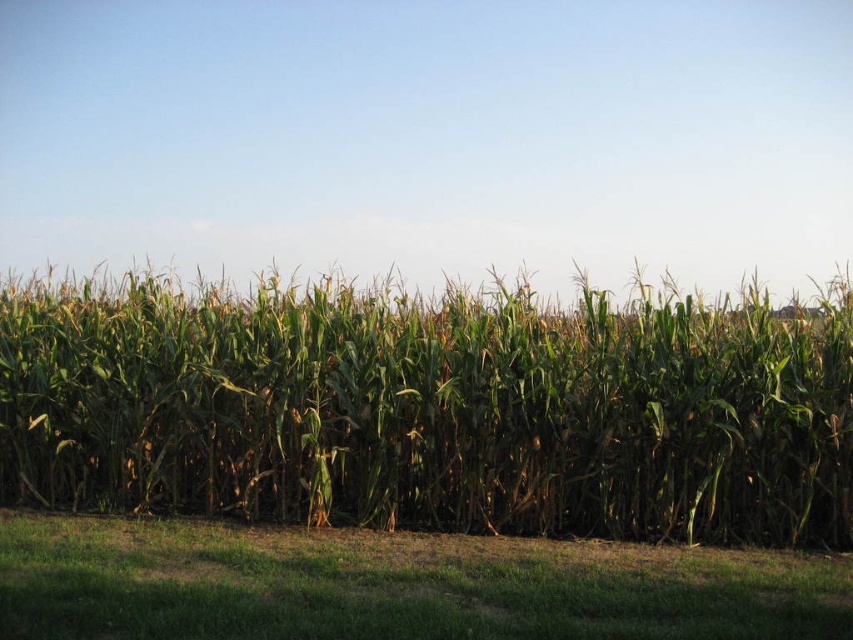
Question: Among these points, which one is nearest to the camera?

Choices:
 (A) (625, 576)
 (B) (718, 314)

Answer: (A)

Question: Can you confirm if green leafy corn at center is thinner than green grass at lower center?

Choices:
 (A) no
 (B) yes

Answer: (B)

Question: Can you confirm if green leafy corn at center is positioned above green grass at lower center?

Choices:
 (A) yes
 (B) no

Answer: (A)

Question: Can you confirm if green leafy corn at center is bigger than green grass at lower center?

Choices:
 (A) yes
 (B) no

Answer: (B)